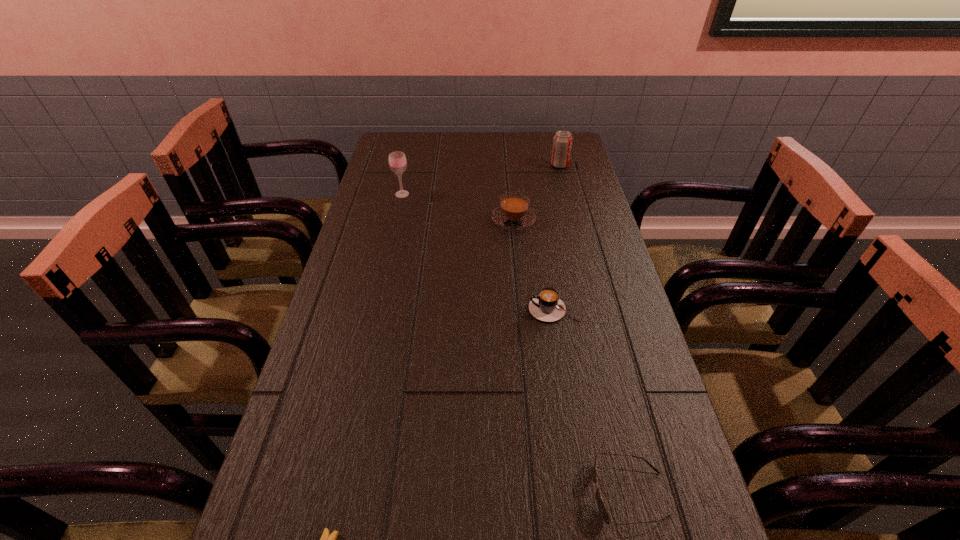
At what (x,y) coordinates should I click in order to perform the action: click on the second farthest object. Please return your answer as a coordinate pair (x, y). Looking at the image, I should click on (397, 160).

This screenshot has height=540, width=960. I want to click on wineglass, so click(x=397, y=160).

I want to click on the fifth shortest object, so click(562, 143).

Identify the location of soda can. (562, 143).

This screenshot has width=960, height=540. In order to click on the farther cappuccino in this screenshot , I will do `click(514, 213)`.

I want to click on the fourth shortest object, so click(x=514, y=213).

Where is `the nearer cappuccino`? the nearer cappuccino is located at coordinates (547, 306).

This screenshot has width=960, height=540. Identify the location of the fourth farthest object. point(547,306).

Where is `sunglasses`? The image size is (960, 540). sunglasses is located at coordinates (602, 509).

Locate an element on the screen. vacant space situated on the back of the wineglass is located at coordinates coord(405,180).